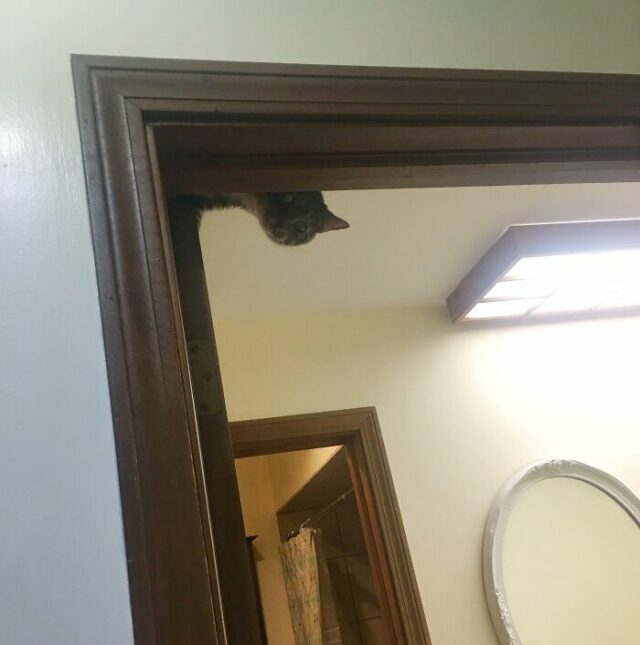
Find the location of a particular element. Image resolution: width=640 pixels, height=645 pixels. shower curtain is located at coordinates (306, 591).